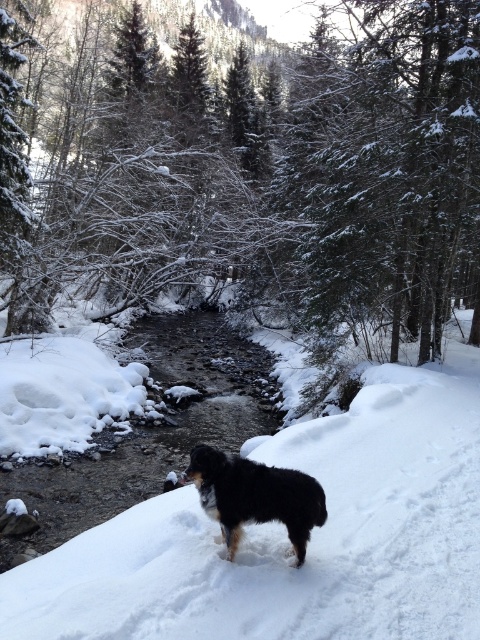
Question: Which of the following is the farthest from the observer?

Choices:
 (A) click(x=346, y=131)
 (B) click(x=351, y=632)
 (C) click(x=297, y=490)

Answer: (A)

Question: Does snow-covered evergreen tree at center have a greater width compared to black fur dog at center?

Choices:
 (A) no
 (B) yes

Answer: (B)

Question: Can you confirm if snow-covered evergreen tree at center is bigger than white fluffy snow at center?

Choices:
 (A) yes
 (B) no

Answer: (A)

Question: Which of the following is the farthest from the observer?

Choices:
 (A) tap(357, 488)
 (B) tap(317, 513)

Answer: (A)

Question: Does snow-covered evergreen tree at center appear under black fur dog at center?

Choices:
 (A) no
 (B) yes

Answer: (A)

Question: Which of the following is the farthest from the observer?

Choices:
 (A) snow-covered evergreen tree at center
 (B) black fur dog at center
 (C) white fluffy snow at center

Answer: (A)